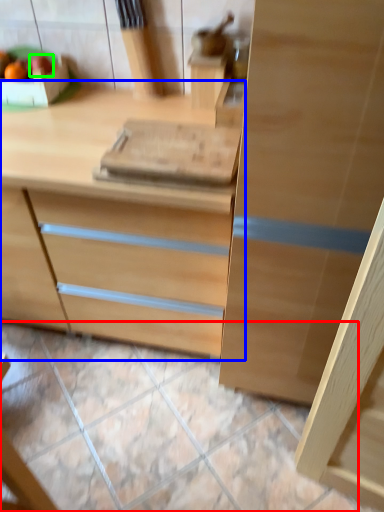
Question: Considering the real-world distances, which object is closest to tile (highlighted by a red box)? chest of drawers (highlighted by a blue box) or fruit (highlighted by a green box).

Choices:
 (A) chest of drawers
 (B) fruit

Answer: (A)